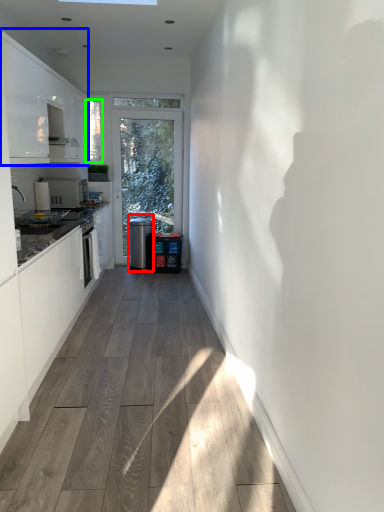
Question: Estimate the real-world distances between objects in this image. Which object is farther from water cooler (highlighted by a red box), cabinetry (highlighted by a blue box) or window screen (highlighted by a green box)?

Choices:
 (A) cabinetry
 (B) window screen

Answer: (A)